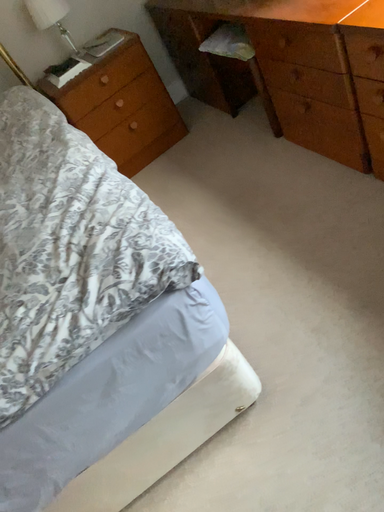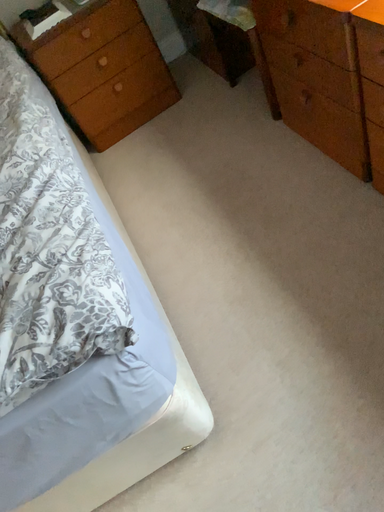
Question: How did the camera likely rotate when shooting the video?

Choices:
 (A) rotated upward
 (B) rotated downward

Answer: (B)